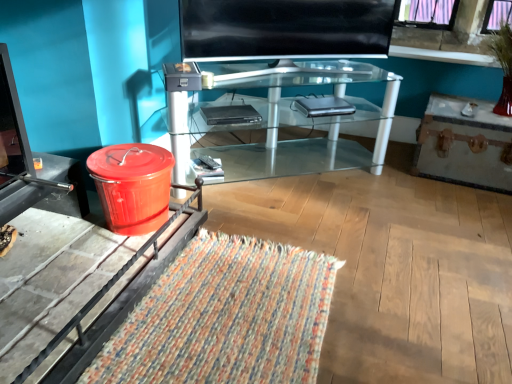
Where is `free space to the back side of woven multicolored mat at lower left`? free space to the back side of woven multicolored mat at lower left is located at coordinates (292, 212).